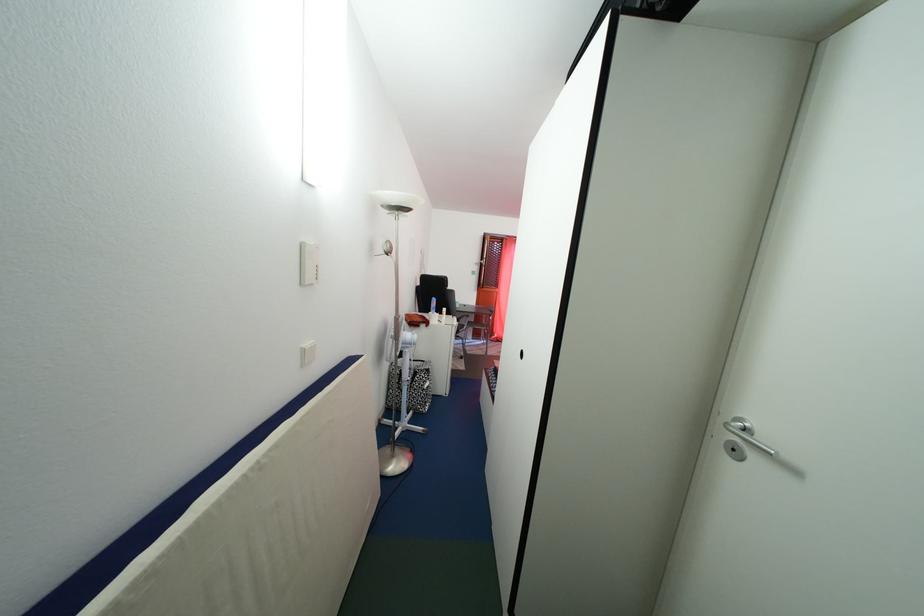
Where is `white light switch`? The width and height of the screenshot is (924, 616). white light switch is located at coordinates (309, 262).